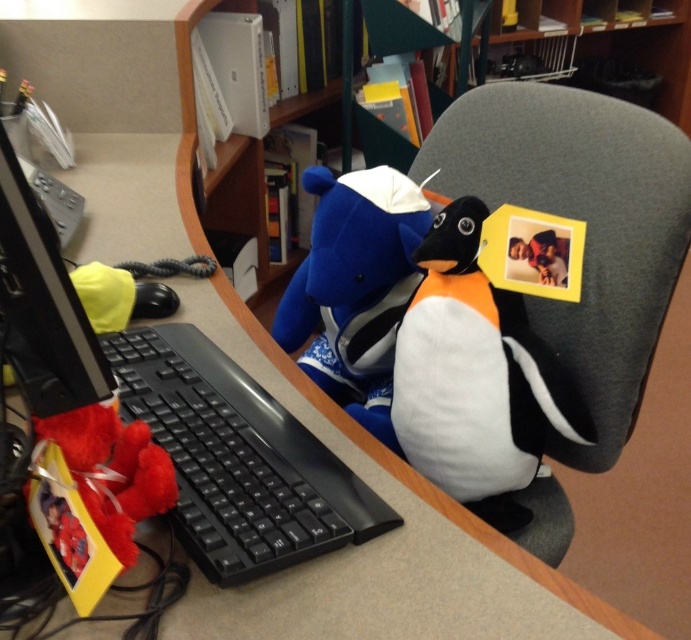
You are sitting in the white fabric swivel chair at right and want to reach the matte black monitor at left. Can you comfortably rest your arms on the desk while using the monitor, considering the height difference between the chair and the monitor?

The white fabric swivel chair at right is taller than the matte black monitor at left. This means you may need to adjust your posture or lower the monitor to comfortably rest your arms on the desk while using it.

You are organizing a desk and need to place a new monitor that is the same size as the matte black monitor at left. There is a space currently occupied by the white plush penguin at right. Can the new monitor fit in that space?

The white plush penguin at right is wider than the matte black monitor at left. Since the new monitor is the same size as the matte black monitor at left, it can fit in the space currently occupied by the white plush penguin at right.

You are a delivery person who needs to place a box on the desk between the white fabric swivel chair at right and the matte black monitor at left. The box is 60 centimeters wide. Will it fit between them?

The distance between the white fabric swivel chair at right and the matte black monitor at left is 70.54 centimeters. Since the box is 60 centimeters wide, it will fit between them with approximately 10.54 centimeters of space remaining.